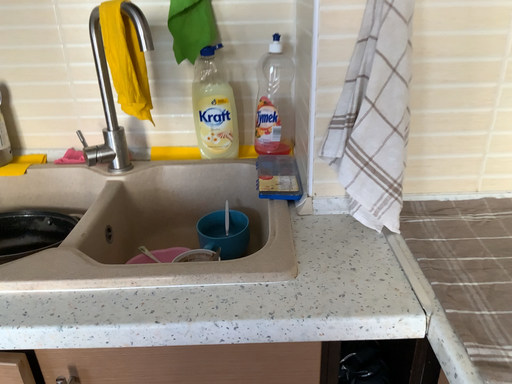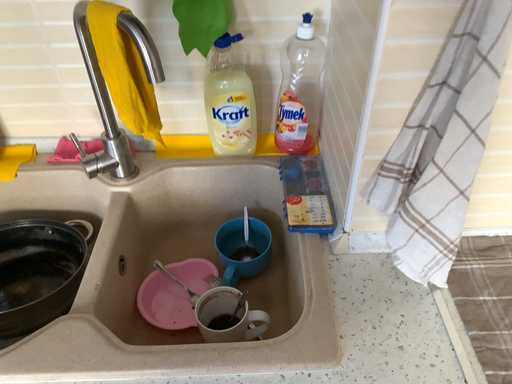
Question: How did the camera likely rotate when shooting the video?

Choices:
 (A) rotated upward
 (B) rotated downward

Answer: (B)